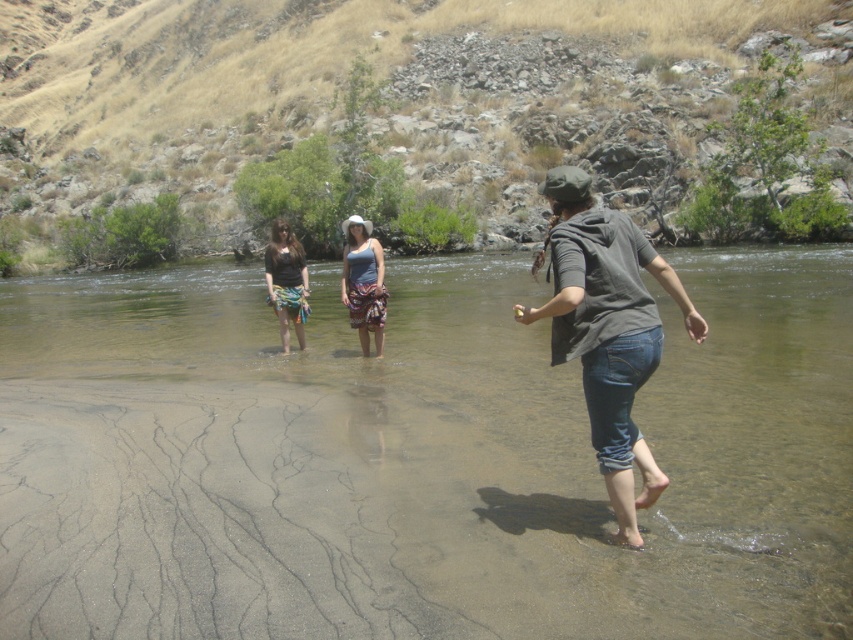
Which is in front, point (312, 321) or point (341, 300)?

Positioned in front is point (341, 300).

Can you confirm if clear sand river at center is positioned to the right of blue cotton tank top at center?

Yes, clear sand river at center is to the right of blue cotton tank top at center.

This screenshot has height=640, width=853. I want to click on clear sand river at center, so click(x=418, y=460).

From the picture: Does denim jeans at center appear on the left side of matte black shirt at center?

No, denim jeans at center is not to the left of matte black shirt at center.

Is point (635, 435) behind point (294, 323)?

No.

The width and height of the screenshot is (853, 640). Describe the element at coordinates (608, 330) in the screenshot. I see `denim jeans at center` at that location.

Find the location of a particular element. Image resolution: width=853 pixels, height=640 pixels. denim jeans at center is located at coordinates (608, 330).

Can you confirm if denim jeans at center is smaller than blue cotton tank top at center?

Yes.

Between denim jeans at center and blue cotton tank top at center, which one appears on the right side from the viewer's perspective?

From the viewer's perspective, denim jeans at center appears more on the right side.

Between point (543, 314) and point (358, 272), which one is positioned behind?

Positioned behind is point (358, 272).

You are a GUI agent. You are given a task and a screenshot of the screen. Output one action in this format:
    pyautogui.click(x=<x>, y=<y>)
    Task: Click on the denim jeans at center
    The width and height of the screenshot is (853, 640).
    Given the screenshot: What is the action you would take?
    pyautogui.click(x=608, y=330)